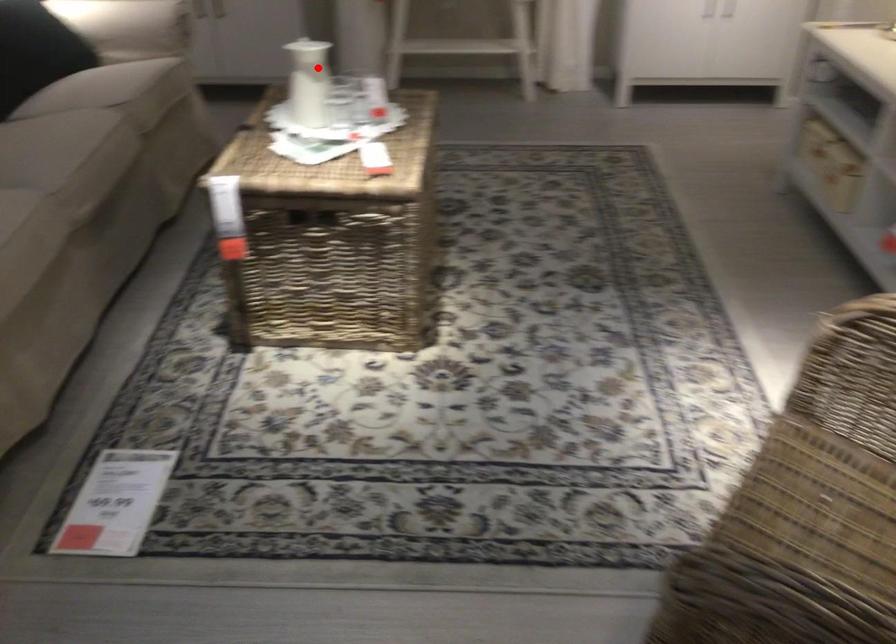
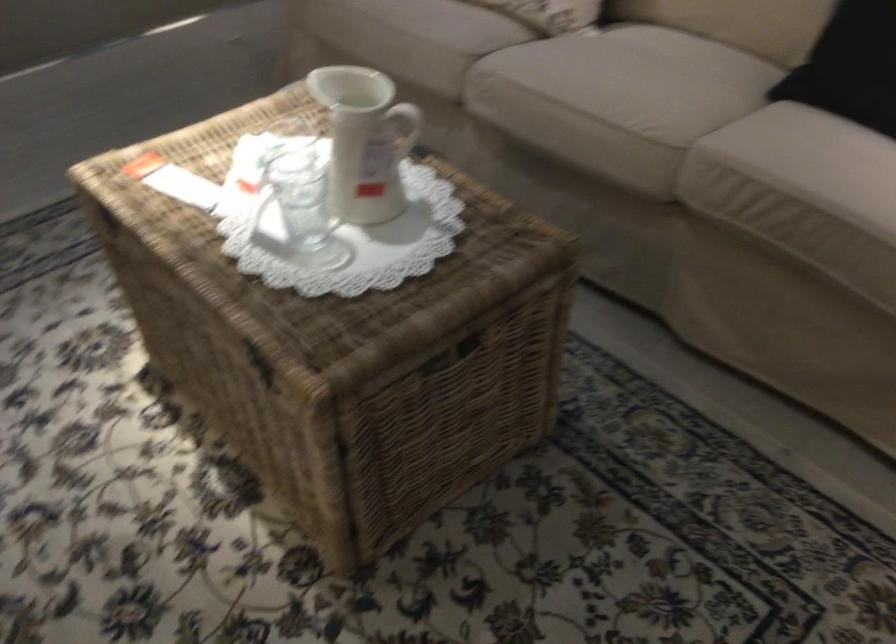
Question: A red point is marked in image1. In image2, is the corresponding 3D point closer to the camera or farther? Reply with the corresponding letter.

Choices:
 (A) The corresponding 3D point is closer.
 (B) The corresponding 3D point is farther.

Answer: (A)